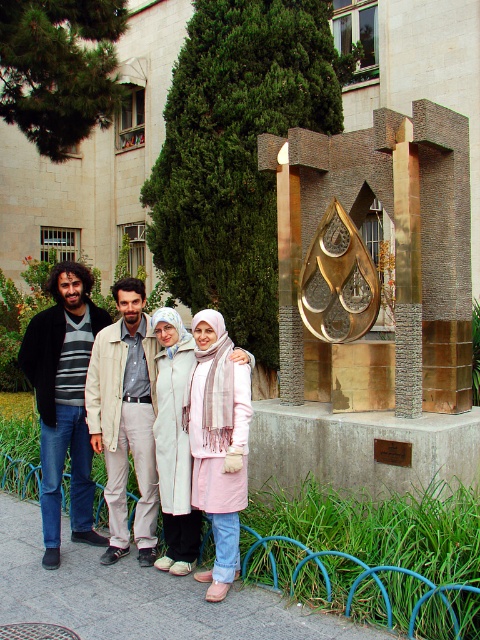
Does gold metallic sculpture at center have a greater width compared to pale pink fabric scarf at center?

Indeed, gold metallic sculpture at center has a greater width compared to pale pink fabric scarf at center.

This screenshot has width=480, height=640. What do you see at coordinates (372, 260) in the screenshot? I see `gold metallic sculpture at center` at bounding box center [372, 260].

Find the location of a particular element. This screenshot has height=640, width=480. gold metallic sculpture at center is located at coordinates (372, 260).

Between point (43, 406) and point (213, 460), which one is positioned in front?

Point (213, 460)

Is light beige coat at center shorter than pale pink fabric scarf at center?

Incorrect, light beige coat at center's height does not fall short of pale pink fabric scarf at center's.

Is point (31, 353) positioned after point (218, 579)?

Yes, point (31, 353) is behind point (218, 579).

Find the location of a particular element. The width and height of the screenshot is (480, 640). light beige coat at center is located at coordinates (93, 404).

Does gold metallic sculpture at center come behind dark blue jeans at left?

No, it is not.

Does gold metallic sculpture at center appear on the left side of dark blue jeans at left?

In fact, gold metallic sculpture at center is to the right of dark blue jeans at left.

You are a GUI agent. You are given a task and a screenshot of the screen. Output one action in this format:
    pyautogui.click(x=<x>, y=<y>)
    Task: Click on the gold metallic sculpture at center
    This screenshot has width=480, height=640.
    Given the screenshot: What is the action you would take?
    [372, 260]